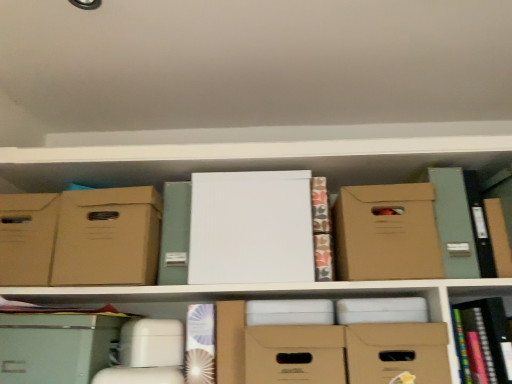
The image size is (512, 384). Describe the element at coordinates (397, 352) in the screenshot. I see `matte cardboard box at lower center, which ranks as the 4th storage box in left-to-right order` at that location.

In order to face matte brown cardboard box at center-right, which is the 2th cardboard box in left-to-right order, should I rotate leftwards or rightwards?

Turn right approximately 16.881 degrees to face it.

Where is `matte brown cardboard box at center-right, the first cardboard box in the right-to-left sequence`? This screenshot has width=512, height=384. matte brown cardboard box at center-right, the first cardboard box in the right-to-left sequence is located at coordinates (386, 233).

The width and height of the screenshot is (512, 384). What do you see at coordinates (175, 234) in the screenshot? I see `white paper at center, the second paperback book positioned from the right` at bounding box center [175, 234].

The width and height of the screenshot is (512, 384). Describe the element at coordinates (57, 346) in the screenshot. I see `matte green storage box at lower left, which is the second storage box in left-to-right order` at that location.

Locate an element on the screen. This screenshot has height=384, width=512. matte brown cardboard box at left, the 2th cardboard box in the right-to-left sequence is located at coordinates (106, 237).

In terms of height, does white matte paper at center, the 2th paperback book in the left-to-right sequence, look taller or shorter compared to matte green storage box at lower left, which is the second storage box in left-to-right order?

Clearly, white matte paper at center, the 2th paperback book in the left-to-right sequence, is taller compared to matte green storage box at lower left, which is the second storage box in left-to-right order.

Is point (269, 203) closer to camera compared to point (46, 336)?

No, (269, 203) is further to viewer.

Relative to matte green storage box at lower left, the third storage box positioned from the right, is white matte paper at center, the 2th paperback book in the left-to-right sequence, in front or behind?

white matte paper at center, the 2th paperback book in the left-to-right sequence, is behind matte green storage box at lower left, the third storage box positioned from the right.

Between matte brown cardboard box at center-right, the first cardboard box in the right-to-left sequence, and matte brown cardboard box at left, the 2th cardboard box in the right-to-left sequence, which one has smaller width?

matte brown cardboard box at left, the 2th cardboard box in the right-to-left sequence, is thinner.

Does matte brown cardboard box at center-right, the first cardboard box in the right-to-left sequence, have a lesser height compared to matte brown cardboard box at left, the 2th cardboard box in the right-to-left sequence?

Yes, matte brown cardboard box at center-right, the first cardboard box in the right-to-left sequence, is shorter than matte brown cardboard box at left, the 2th cardboard box in the right-to-left sequence.

Is matte brown cardboard box at center-right, the first cardboard box in the right-to-left sequence, oriented away from matte brown cardboard box at left, which ranks as the 1th cardboard box in left-to-right order?

matte brown cardboard box at center-right, the first cardboard box in the right-to-left sequence, does not have its back to matte brown cardboard box at left, which ranks as the 1th cardboard box in left-to-right order.

Does matte brown cardboard box at center-right, the first cardboard box in the right-to-left sequence, have a larger size compared to matte brown cardboard box at left, which ranks as the 1th cardboard box in left-to-right order?

Yes.

Can you see matte cardboard box at left, acting as the fourth storage box starting from the right, touching white matte paper at center, placed as the 1th paperback book when sorted from right to left?

No, matte cardboard box at left, acting as the fourth storage box starting from the right, is not beside white matte paper at center, placed as the 1th paperback book when sorted from right to left.

Considering the relative positions of matte cardboard box at left, which is the 1th storage box in left-to-right order, and white matte paper at center, the 2th paperback book in the left-to-right sequence, in the image provided, is matte cardboard box at left, which is the 1th storage box in left-to-right order, behind white matte paper at center, the 2th paperback book in the left-to-right sequence,?

Yes, matte cardboard box at left, which is the 1th storage box in left-to-right order, is further from the camera.

You are a GUI agent. You are given a task and a screenshot of the screen. Output one action in this format:
    pyautogui.click(x=<x>, y=<y>)
    Task: Click on the storage box that appears behind the white matte paper at center, the 2th paperback book in the left-to-right sequence
    The width and height of the screenshot is (512, 384).
    Given the screenshot: What is the action you would take?
    pyautogui.click(x=27, y=238)

Considering the relative sizes of white paper at center, the 1th paperback book in the left-to-right sequence, and matte cardboard box at center, the second storage box in the right-to-left sequence, in the image provided, is white paper at center, the 1th paperback book in the left-to-right sequence, smaller than matte cardboard box at center, the second storage box in the right-to-left sequence,?

Correct, white paper at center, the 1th paperback book in the left-to-right sequence, occupies less space than matte cardboard box at center, the second storage box in the right-to-left sequence.

Based on their positions, is white paper at center, the second paperback book positioned from the right, located to the left or right of matte cardboard box at center, arranged as the 3th storage box when viewed from the left?

white paper at center, the second paperback book positioned from the right, is to the left of matte cardboard box at center, arranged as the 3th storage box when viewed from the left.

Can you see white paper at center, the second paperback book positioned from the right, touching matte cardboard box at center, the second storage box in the right-to-left sequence?

There is a gap between white paper at center, the second paperback book positioned from the right, and matte cardboard box at center, the second storage box in the right-to-left sequence.

Is white paper at center, the 1th paperback book in the left-to-right sequence, positioned in front of matte cardboard box at center, the second storage box in the right-to-left sequence?

No, white paper at center, the 1th paperback book in the left-to-right sequence, is further to the viewer.

Find the location of a particular element. This screenshot has width=512, height=384. the 1st paperback book to the left when counting from the matte brown cardboard box at center-right, the first cardboard box in the right-to-left sequence is located at coordinates click(x=251, y=228).

Is matte brown cardboard box at center-right, which is the 2th cardboard box in left-to-right order, looking in the opposite direction of white matte paper at center, the 2th paperback book in the left-to-right sequence?

No, matte brown cardboard box at center-right, which is the 2th cardboard box in left-to-right order, is not facing away from white matte paper at center, the 2th paperback book in the left-to-right sequence.

Which object is closer to the camera, matte brown cardboard box at center-right, the first cardboard box in the right-to-left sequence, or white matte paper at center, the 2th paperback book in the left-to-right sequence?

Positioned in front is matte brown cardboard box at center-right, the first cardboard box in the right-to-left sequence.

Would you say matte brown cardboard box at center-right, which is the 2th cardboard box in left-to-right order, contains white matte paper at center, the 2th paperback book in the left-to-right sequence?

No.

From the image's perspective, is white paper at center, which is the 2th book in right-to-left order, above or below white paper at center, the 1th paperback book in the left-to-right sequence?

From the image's perspective, white paper at center, which is the 2th book in right-to-left order, appears below white paper at center, the 1th paperback book in the left-to-right sequence.

Is the position of white paper at center, which is the 2th book in right-to-left order, less distant than that of white paper at center, the 1th paperback book in the left-to-right sequence?

Yes, white paper at center, which is the 2th book in right-to-left order, is closer to the viewer.

Is white paper at center, the 1th book positioned from the left, with white paper at center, the 1th paperback book in the left-to-right sequence?

No, white paper at center, the 1th book positioned from the left, is not in contact with white paper at center, the 1th paperback book in the left-to-right sequence.

Which object is positioned more to the left, matte brown cardboard box at center-right, which is the 2th cardboard box in left-to-right order, or matte cardboard box at lower center, which ranks as the 4th storage box in left-to-right order?

matte cardboard box at lower center, which ranks as the 4th storage box in left-to-right order.

Is matte brown cardboard box at center-right, the first cardboard box in the right-to-left sequence, smaller than matte cardboard box at lower center, the first storage box in the right-to-left sequence?

Actually, matte brown cardboard box at center-right, the first cardboard box in the right-to-left sequence, might be larger than matte cardboard box at lower center, the first storage box in the right-to-left sequence.

From the picture: In the image, is matte brown cardboard box at center-right, the first cardboard box in the right-to-left sequence, positioned in front of or behind matte cardboard box at lower center, the first storage box in the right-to-left sequence?

matte brown cardboard box at center-right, the first cardboard box in the right-to-left sequence, is behind matte cardboard box at lower center, the first storage box in the right-to-left sequence.

I want to click on cardboard box on the right of matte cardboard box at lower center, the first storage box in the right-to-left sequence, so click(386, 233).

There is a white matte paper at center, placed as the 1th paperback book when sorted from right to left. Identify the location of the 2nd storage box below it (from a real-world perspective). The height and width of the screenshot is (384, 512). (57, 346).

At what (x,y) coordinates should I click in order to perform the action: click on cardboard box located above the matte brown cardboard box at left, which ranks as the 1th cardboard box in left-to-right order (from the image's perspective). Please return your answer as a coordinate pair (x, y). Looking at the image, I should click on (386, 233).

From the image, which object appears to be farther from matte cardboard box at left, acting as the fourth storage box starting from the right, matte cardboard box at center, arranged as the 3th storage box when viewed from the left, or white matte paper at center, placed as the 1th paperback book when sorted from right to left?

matte cardboard box at center, arranged as the 3th storage box when viewed from the left.

Consider the image. Looking at the image, which one is located further to matte brown cardboard box at left, the 2th cardboard box in the right-to-left sequence, matte cardboard box at left, which is the 1th storage box in left-to-right order, or matte brown cardboard box at center-right, which is the 2th cardboard box in left-to-right order?

Based on the image, matte brown cardboard box at center-right, which is the 2th cardboard box in left-to-right order, appears to be further to matte brown cardboard box at left, the 2th cardboard box in the right-to-left sequence.

Looking at the image, which one is located closer to white matte paper at center, placed as the 1th paperback book when sorted from right to left, matte cardboard box at center, the second storage box in the right-to-left sequence, or matte green storage box at lower left, which is the second storage box in left-to-right order?

matte cardboard box at center, the second storage box in the right-to-left sequence, is positioned closer to the anchor white matte paper at center, placed as the 1th paperback book when sorted from right to left.

Estimate the real-world distances between objects in this image. Which object is closer to matte brown cardboard box at center-right, which is the 2th cardboard box in left-to-right order, matte brown cardboard box at left, which ranks as the 1th cardboard box in left-to-right order, or white paper at center, the 1th book positioned from the left?

white paper at center, the 1th book positioned from the left.

Which object lies nearer to the anchor point white paper at center, the 1th book positioned from the left, matte cardboard box at left, which is the 1th storage box in left-to-right order, or matte cardboard box at lower center, the first storage box in the right-to-left sequence?

matte cardboard box at lower center, the first storage box in the right-to-left sequence, is closer to white paper at center, the 1th book positioned from the left.

From the image, which object appears to be farther from matte brown cardboard box at center-right, the first cardboard box in the right-to-left sequence, multicolored hardcover book at lower right, which is the 2th book from left to right, or matte brown cardboard box at left, the 2th cardboard box in the right-to-left sequence?

matte brown cardboard box at left, the 2th cardboard box in the right-to-left sequence, lies further to matte brown cardboard box at center-right, the first cardboard box in the right-to-left sequence, than the other object.

Looking at the image, which one is located closer to white paper at center, the second paperback book positioned from the right, matte cardboard box at center, arranged as the 3th storage box when viewed from the left, or matte cardboard box at lower center, the first storage box in the right-to-left sequence?

matte cardboard box at center, arranged as the 3th storage box when viewed from the left, lies closer to white paper at center, the second paperback book positioned from the right, than the other object.

Which object lies nearer to the anchor point matte brown cardboard box at center-right, the first cardboard box in the right-to-left sequence, white matte paper at center, the 2th paperback book in the left-to-right sequence, or matte cardboard box at lower center, which ranks as the 4th storage box in left-to-right order?

Among the two, matte cardboard box at lower center, which ranks as the 4th storage box in left-to-right order, is located nearer to matte brown cardboard box at center-right, the first cardboard box in the right-to-left sequence.

The image size is (512, 384). I want to click on paperback book between matte green storage box at lower left, the third storage box positioned from the right, and white paper at center, the 1th book positioned from the left, from left to right, so click(175, 234).

The image size is (512, 384). I want to click on cardboard box between matte cardboard box at left, acting as the fourth storage box starting from the right, and matte cardboard box at lower center, which ranks as the 4th storage box in left-to-right order, so click(106, 237).

You are a GUI agent. You are given a task and a screenshot of the screen. Output one action in this format:
    pyautogui.click(x=<x>, y=<y>)
    Task: Click on the book between matte brown cardboard box at left, the 2th cardboard box in the right-to-left sequence, and matte cardboard box at lower center, which ranks as the 4th storage box in left-to-right order
    
    Given the screenshot: What is the action you would take?
    pyautogui.click(x=200, y=344)

The height and width of the screenshot is (384, 512). What are the coordinates of `book between matte green storage box at lower left, which is the second storage box in left-to-right order, and multicolored hardcover book at lower right, the first book from the right, from left to right` in the screenshot? It's located at (200, 344).